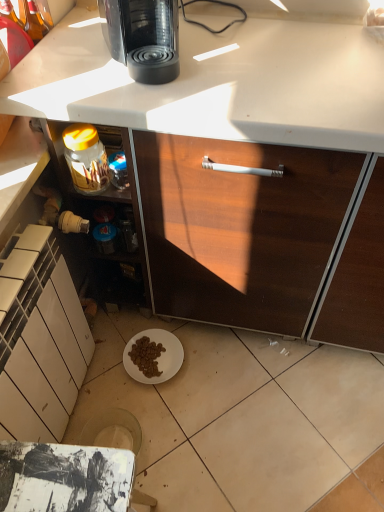
Identify the location of vacant space to the right of white matte cabinet at lower left. (179, 415).